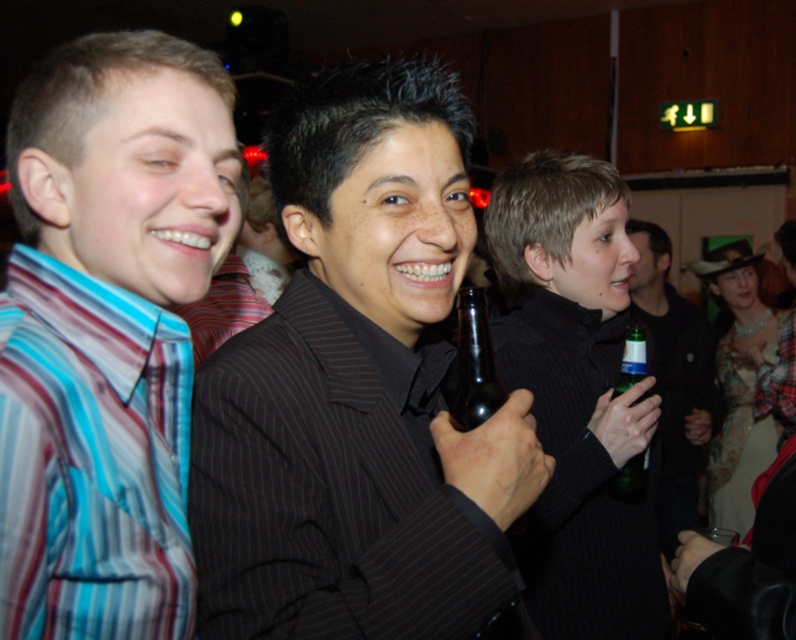
Does striped cotton shirt at left have a greater height compared to brown glass bottle at center?

Indeed, striped cotton shirt at left has a greater height compared to brown glass bottle at center.

Is striped cotton shirt at left wider than brown glass bottle at center?

Yes, striped cotton shirt at left is wider than brown glass bottle at center.

Describe the element at coordinates (92, 458) in the screenshot. I see `striped cotton shirt at left` at that location.

Identify the location of striped cotton shirt at left. (92, 458).

Between dark pinstripe suit at center and green glass bottle at right, which one appears on the right side from the viewer's perspective?

From the viewer's perspective, green glass bottle at right appears more on the right side.

Can you confirm if dark pinstripe suit at center is shorter than green glass bottle at right?

Indeed, dark pinstripe suit at center has a lesser height compared to green glass bottle at right.

Identify the location of dark pinstripe suit at center. The height and width of the screenshot is (640, 796). (357, 392).

Does striped cotton shirt at left have a larger size compared to matte black suit at center?

No.

Consider the image. Can you confirm if striped cotton shirt at left is taller than matte black suit at center?

Incorrect, striped cotton shirt at left's height is not larger of matte black suit at center's.

Who is more distant from viewer, (16, 310) or (209, 304)?

The point (209, 304) is more distant.

The image size is (796, 640). Find the location of `striped cotton shirt at left`. striped cotton shirt at left is located at coordinates (92, 458).